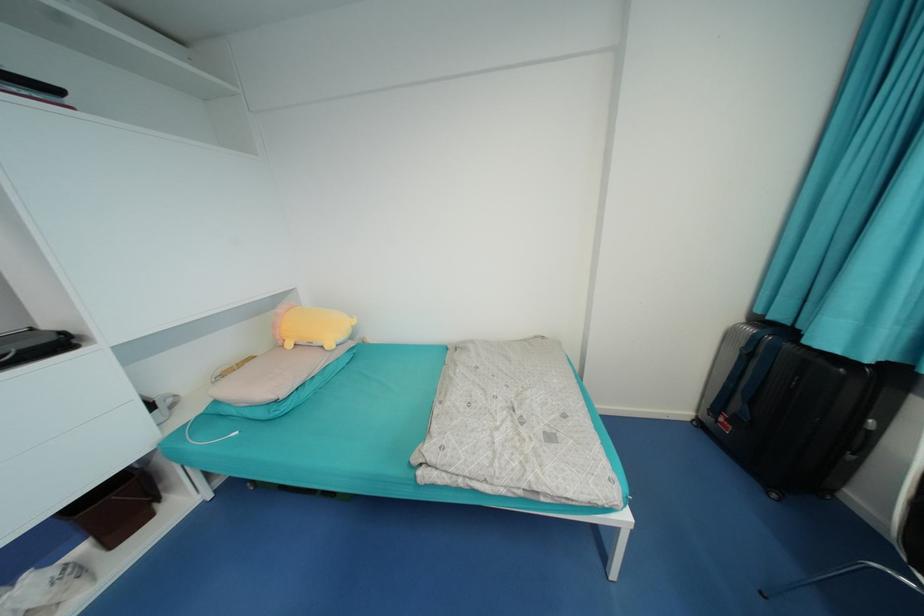
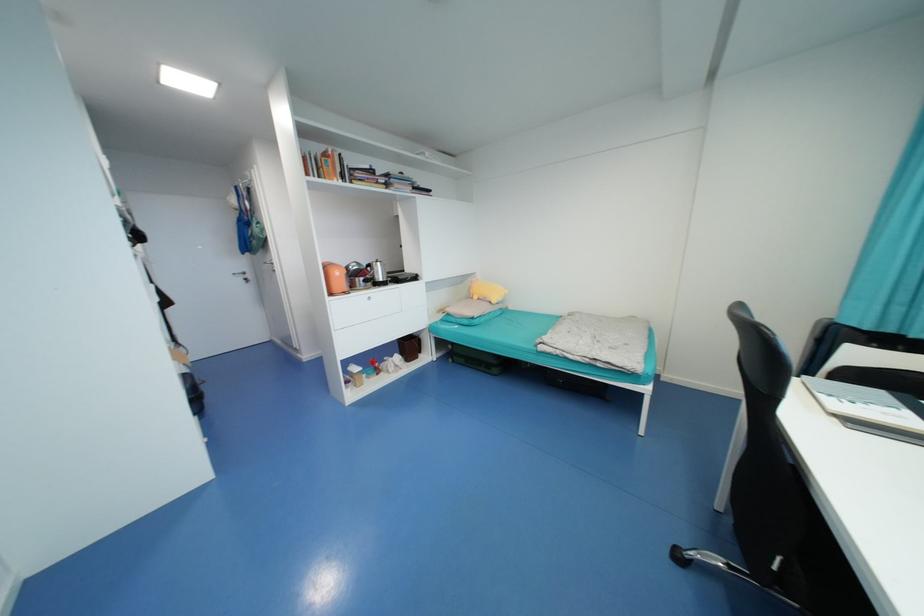
Question: In a continuous first-person perspective shot, in which direction is the camera moving?

Choices:
 (A) Left
 (B) Right
 (C) Forward
 (D) Backward

Answer: (D)